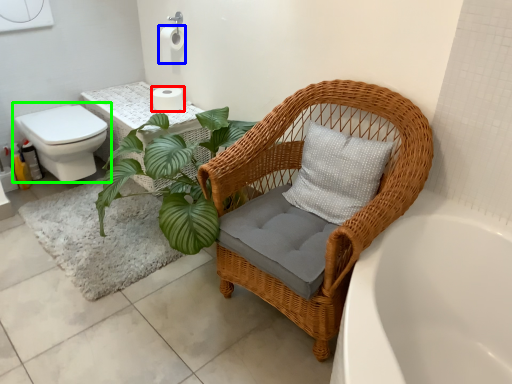
Question: Considering the real-world distances, which object is closest to toilet paper (highlighted by a red box)? toilet paper (highlighted by a blue box) or toilet (highlighted by a green box).

Choices:
 (A) toilet paper
 (B) toilet

Answer: (A)